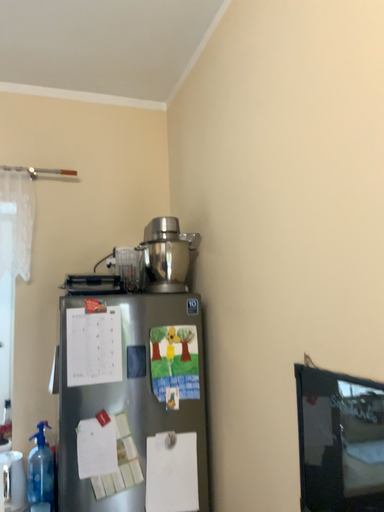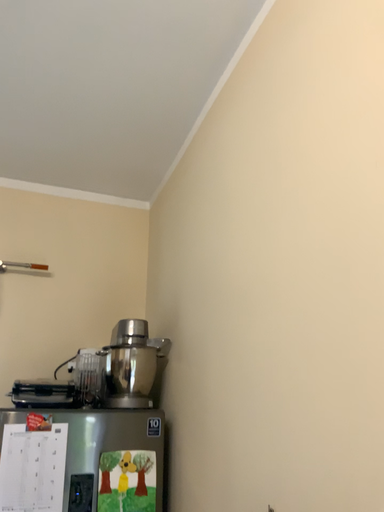
Question: Which way did the camera rotate in the video?

Choices:
 (A) rotated downward
 (B) rotated upward

Answer: (B)